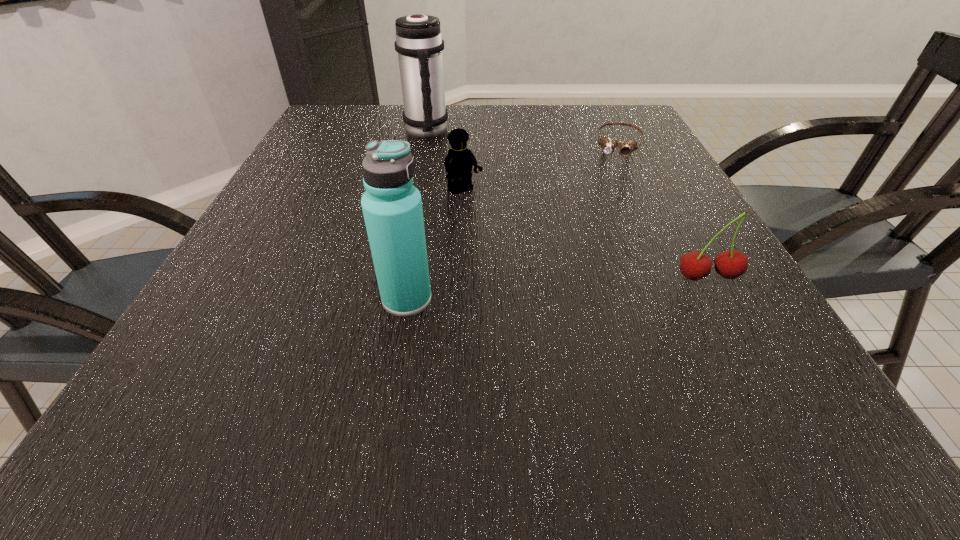
Find the location of a particular element. The width and height of the screenshot is (960, 540). the nearer thermos bottle is located at coordinates (392, 207).

Identify the location of cherry. Image resolution: width=960 pixels, height=540 pixels. (730, 264).

This screenshot has width=960, height=540. I want to click on the farther thermos bottle, so click(419, 43).

Find the location of a particular element. Image resolution: width=960 pixels, height=540 pixels. the shortest object is located at coordinates (607, 144).

Where is `Lego`? This screenshot has width=960, height=540. Lego is located at coordinates (459, 161).

Identify the location of the third farthest object. (459, 161).

At what (x,y) coordinates should I click in order to perform the action: click on vacant space located on the right of the nearer thermos bottle. Please return your answer as a coordinate pair (x, y). The image size is (960, 540). Looking at the image, I should click on (534, 299).

The height and width of the screenshot is (540, 960). Identify the location of free space located on the surface of the cherry. (744, 343).

The height and width of the screenshot is (540, 960). What are the coordinates of `free space located on the side with the handle of the farther thermos bottle` in the screenshot? It's located at (443, 155).

Where is `free spot located 0.120m on the side with the handle of the farther thermos bottle`? free spot located 0.120m on the side with the handle of the farther thermos bottle is located at coordinates (449, 164).